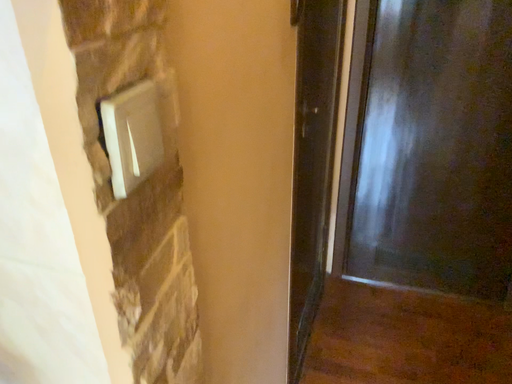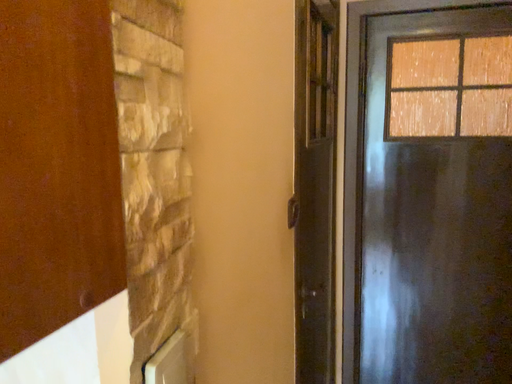
Question: How did the camera likely rotate when shooting the video?

Choices:
 (A) rotated downward
 (B) rotated upward

Answer: (B)